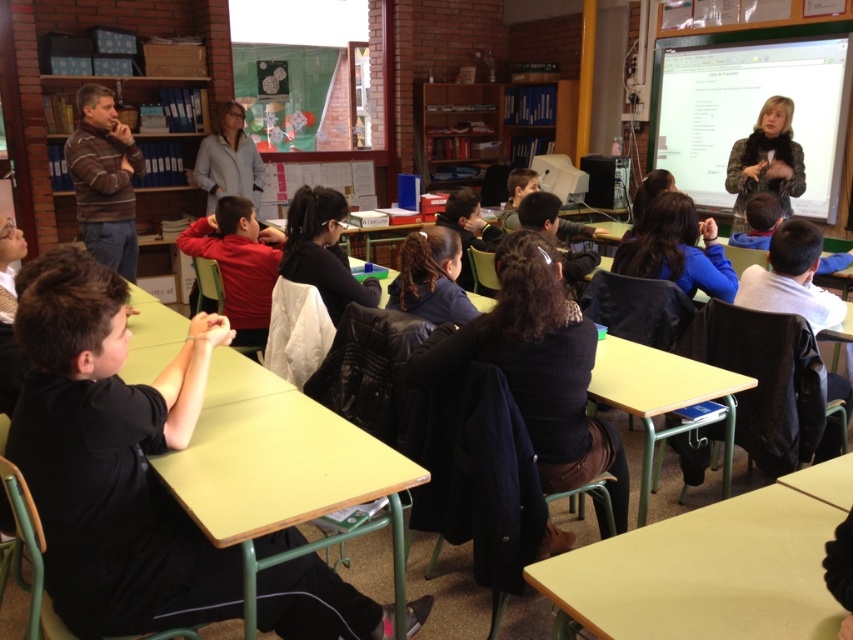
You are standing in the classroom and want to hang a poster on the wall. The bulletin board is at a specific location. Where exactly is the green fabric bulletin board at upper right located in terms of coordinates?

The green fabric bulletin board at upper right is located at coordinates point (752, 108).

You are a student who needs to place a heavy textbook on a surface. Which object between the light wood table at lower right and the green fabric bulletin board at upper right would be more suitable for placing the textbook?

The light wood table at lower right is more suitable for placing the textbook because it has a lesser height compared to the green fabric bulletin board at upper right, making it a stable surface for heavy items.

You are a student in the classroom and need to place a large project poster. Which object, the light wood table at lower right or the green fabric bulletin board at upper right, is more suitable for displaying the poster?

The green fabric bulletin board at upper right is more suitable for displaying the poster because it has a larger size compared to the light wood table at lower right.